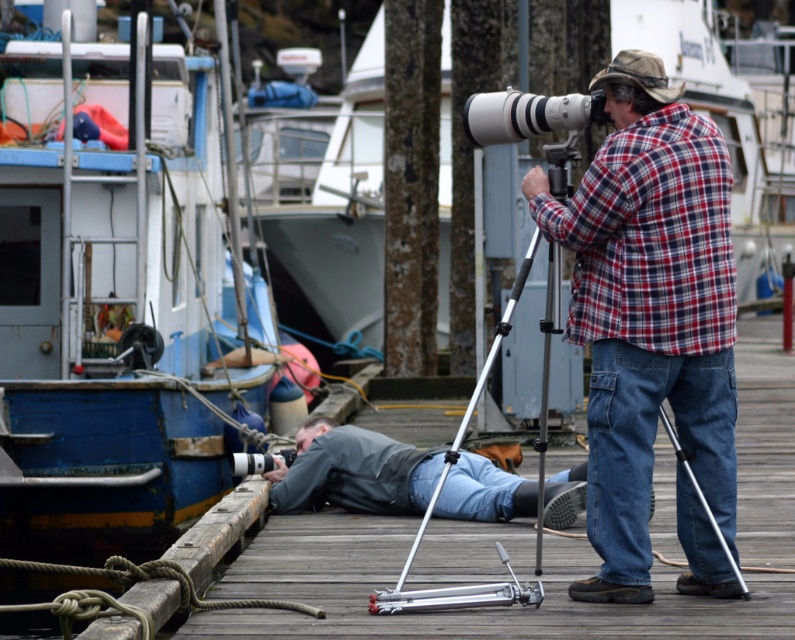
Can you confirm if blue painted wood boat at left is wider than silver metallic tripod at center?

Yes.

Can you confirm if blue painted wood boat at left is taller than silver metallic tripod at center?

Yes.

Which is behind, point (103, 294) or point (549, 248)?

Positioned behind is point (103, 294).

I want to click on blue painted wood boat at left, so click(x=114, y=339).

From the picture: Can you confirm if white plastic boat at center is bigger than black plastic camera at center?

Yes.

Locate an element on the screen. white plastic boat at center is located at coordinates (339, 204).

Is point (26, 596) closer to camera compared to point (617, 273)?

No, (26, 596) is further to viewer.

Can you confirm if blue painted wood boat at left is positioned above plaid fabric at center?

Indeed, blue painted wood boat at left is positioned over plaid fabric at center.

The width and height of the screenshot is (795, 640). Identify the location of blue painted wood boat at left. (114, 339).